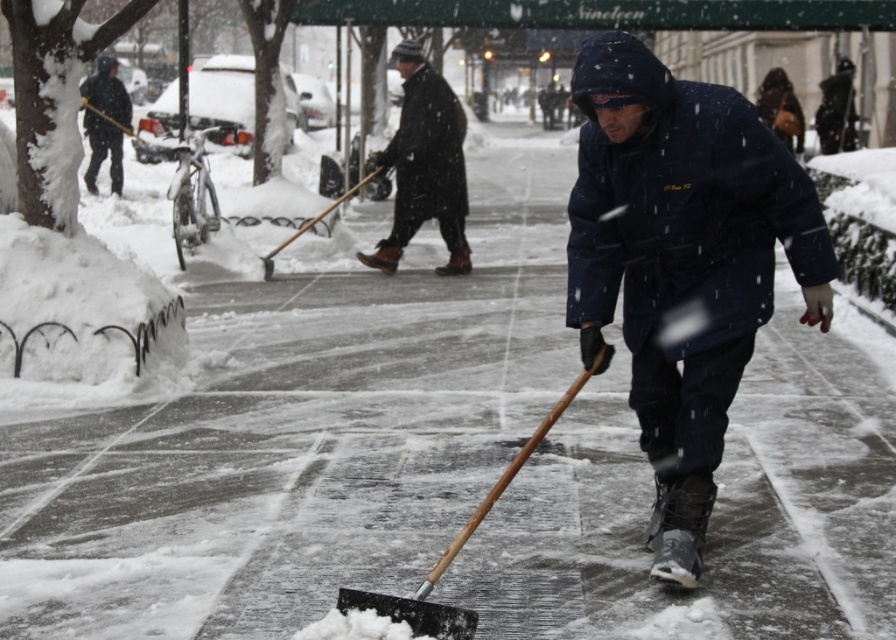
You are a snow removal worker who needs to choose a shovel to clear a narrow sidewalk. The black plastic shovel at center and the wooden shovel at center are available. Which shovel would you choose and why?

You should choose the wooden shovel at center because its width is smaller than the black plastic shovel at center, making it easier to maneuver in narrow spaces.

You are a delivery person who needs to pick up a shovel to clear the snow. You see the black plastic shovel at center and the wooden shovel at center. Which shovel is closer to you?

The black plastic shovel at center and wooden shovel at center are 9.45 meters apart from each other, so you need to determine which one is closer based on their positions. However, the description does not specify which shovel is closer to you. Please check their locations again.